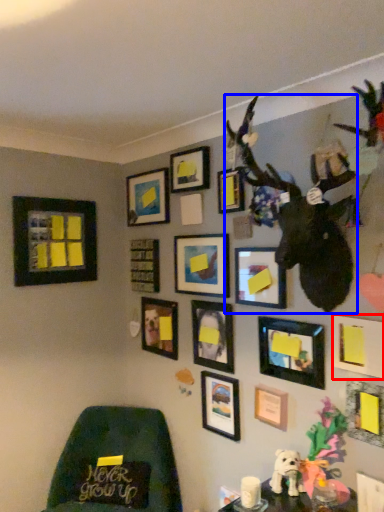
Question: Which object is further to the camera taking this photo, picture frame (highlighted by a red box) or animal (highlighted by a blue box)?

Choices:
 (A) picture frame
 (B) animal

Answer: (A)